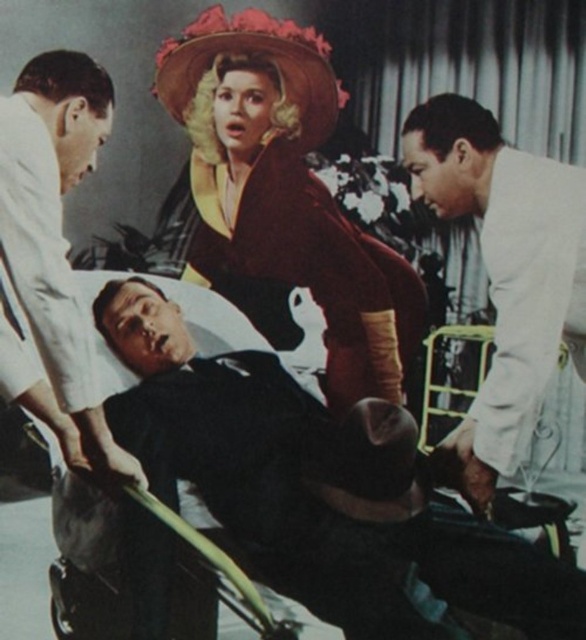
Looking at this image, can you confirm if velvet maroon dress at center is positioned to the left of white cloth coat at left?

No, velvet maroon dress at center is not to the left of white cloth coat at left.

Is velvet maroon dress at center positioned in front of white cloth coat at left?

No, it is not.

Measure the distance between velvet maroon dress at center and camera.

A distance of 2.53 meters exists between velvet maroon dress at center and camera.

What are the coordinates of `velvet maroon dress at center` in the screenshot? It's located at (284, 198).

In the scene shown: Is black matte suit at center thinner than velvet maroon dress at center?

Incorrect, black matte suit at center's width is not less than velvet maroon dress at center's.

Between black matte suit at center and velvet maroon dress at center, which one appears on the left side from the viewer's perspective?

From the viewer's perspective, black matte suit at center appears more on the left side.

What do you see at coordinates (328, 490) in the screenshot? The height and width of the screenshot is (640, 586). I see `black matte suit at center` at bounding box center [328, 490].

At what (x,y) coordinates should I click in order to perform the action: click on black matte suit at center. Please return your answer as a coordinate pair (x, y). This screenshot has height=640, width=586. Looking at the image, I should click on (328, 490).

Between black matte suit at center and white matte coat at right, which one is positioned lower?

black matte suit at center is lower down.

Which is in front, point (275, 451) or point (444, 184)?

Positioned in front is point (275, 451).

Find the location of `black matte suit at center`. black matte suit at center is located at coordinates (328, 490).